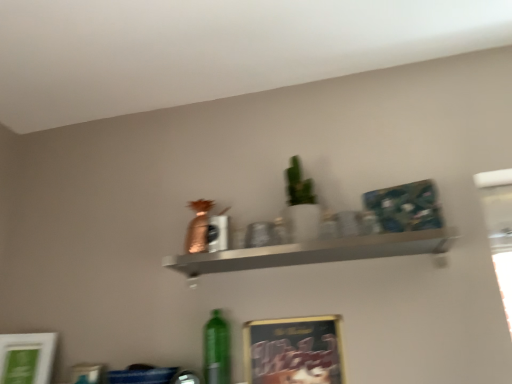
This screenshot has height=384, width=512. Describe the element at coordinates (316, 252) in the screenshot. I see `metallic silver shelf at center` at that location.

In order to click on metallic silver shelf at center in this screenshot , I will do `click(316, 252)`.

Where is `green matte bottle at lower center`? green matte bottle at lower center is located at coordinates (216, 350).

Considering the positions of point (338, 358) and point (0, 360), is point (338, 358) closer or farther from the camera than point (0, 360)?

Point (338, 358) is closer to the camera than point (0, 360).

Considering the relative sizes of metallic gold picture frame at lower center, marked as the 1th picture frame in a right-to-left arrangement, and white matte picture frame at lower left, the first picture frame from the left, in the image provided, is metallic gold picture frame at lower center, marked as the 1th picture frame in a right-to-left arrangement, shorter than white matte picture frame at lower left, the first picture frame from the left,?

No.

Is metallic gold picture frame at lower center, marked as the 1th picture frame in a right-to-left arrangement, in front of or behind white matte picture frame at lower left, the 2th picture frame when ordered from right to left, in the image?

metallic gold picture frame at lower center, marked as the 1th picture frame in a right-to-left arrangement, is in front of white matte picture frame at lower left, the 2th picture frame when ordered from right to left.

Looking at their sizes, would you say metallic gold picture frame at lower center, which is the 2th picture frame in left-to-right order, is wider or thinner than white matte picture frame at lower left, the 2th picture frame when ordered from right to left?

Clearly, metallic gold picture frame at lower center, which is the 2th picture frame in left-to-right order, has less width compared to white matte picture frame at lower left, the 2th picture frame when ordered from right to left.

Is point (42, 350) closer to camera compared to point (230, 372)?

No, (42, 350) is behind (230, 372).

There is a green matte bottle at lower center. Where is `the 1st picture frame below it (from the image's perspective)`? The height and width of the screenshot is (384, 512). the 1st picture frame below it (from the image's perspective) is located at coordinates (26, 357).

Is white matte picture frame at lower left, the 2th picture frame when ordered from right to left, facing towards green matte bottle at lower center?

No, white matte picture frame at lower left, the 2th picture frame when ordered from right to left, is not aimed at green matte bottle at lower center.

Is there a large distance between metallic silver shelf at center and green matte bottle at lower center?

No, there isn't a large distance between metallic silver shelf at center and green matte bottle at lower center.

How far apart are metallic silver shelf at center and green matte bottle at lower center?

metallic silver shelf at center and green matte bottle at lower center are 33.80 centimeters apart.

Which is less distant, (342,251) or (211,379)?

Positioned in front is point (342,251).

Does metallic silver shelf at center come behind green matte bottle at lower center?

No, it is in front of green matte bottle at lower center.

Is metallic gold picture frame at lower center, marked as the 1th picture frame in a right-to-left arrangement, outside of metallic silver shelf at center?

Yes.

Find the location of a particular element. shelf on the right of metallic gold picture frame at lower center, which is the 2th picture frame in left-to-right order is located at coordinates (316, 252).

Considering the sizes of objects white matte picture frame at lower left, the first picture frame from the left, and metallic gold picture frame at lower center, marked as the 1th picture frame in a right-to-left arrangement, in the image provided, who is taller, white matte picture frame at lower left, the first picture frame from the left, or metallic gold picture frame at lower center, marked as the 1th picture frame in a right-to-left arrangement,?

metallic gold picture frame at lower center, marked as the 1th picture frame in a right-to-left arrangement.

Is white matte picture frame at lower left, the 2th picture frame when ordered from right to left, oriented away from metallic gold picture frame at lower center, marked as the 1th picture frame in a right-to-left arrangement?

white matte picture frame at lower left, the 2th picture frame when ordered from right to left, is not turned away from metallic gold picture frame at lower center, marked as the 1th picture frame in a right-to-left arrangement.

How different are the orientations of white matte picture frame at lower left, the first picture frame from the left, and metallic gold picture frame at lower center, which is the 2th picture frame in left-to-right order, in degrees?

There is a 21.1-degree angle between the facing directions of white matte picture frame at lower left, the first picture frame from the left, and metallic gold picture frame at lower center, which is the 2th picture frame in left-to-right order.

Choose the correct answer: Is white matte picture frame at lower left, the first picture frame from the left, inside metallic gold picture frame at lower center, marked as the 1th picture frame in a right-to-left arrangement, or outside it?

white matte picture frame at lower left, the first picture frame from the left, lies outside metallic gold picture frame at lower center, marked as the 1th picture frame in a right-to-left arrangement.

Between green matte bottle at lower center and white matte picture frame at lower left, the first picture frame from the left, which one has less height?

green matte bottle at lower center is shorter.

Is green matte bottle at lower center thinner than white matte picture frame at lower left, the first picture frame from the left?

Yes.

Which object is more forward, green matte bottle at lower center or white matte picture frame at lower left, the 2th picture frame when ordered from right to left?

Positioned in front is white matte picture frame at lower left, the 2th picture frame when ordered from right to left.

Would you say green matte bottle at lower center is inside or outside white matte picture frame at lower left, the first picture frame from the left?

green matte bottle at lower center is not inside white matte picture frame at lower left, the first picture frame from the left, it's outside.

Considering the positions of objects metallic silver shelf at center and white matte picture frame at lower left, the 2th picture frame when ordered from right to left, in the image provided, who is in front, metallic silver shelf at center or white matte picture frame at lower left, the 2th picture frame when ordered from right to left,?

metallic silver shelf at center.

Is metallic silver shelf at center spatially inside white matte picture frame at lower left, the first picture frame from the left, or outside of it?

The correct answer is: outside.

Is point (353, 257) closer to camera compared to point (42, 334)?

Yes, point (353, 257) is closer to viewer.

Can you tell me how much metallic silver shelf at center and white matte picture frame at lower left, the 2th picture frame when ordered from right to left, differ in facing direction?

The angle between the facing direction of metallic silver shelf at center and the facing direction of white matte picture frame at lower left, the 2th picture frame when ordered from right to left, is 20.6 degrees.

You are a GUI agent. You are given a task and a screenshot of the screen. Output one action in this format:
    pyautogui.click(x=<x>, y=<y>)
    Task: Click on the picture frame above the metallic gold picture frame at lower center, marked as the 1th picture frame in a right-to-left arrangement (from the image's perspective)
    The image size is (512, 384).
    Given the screenshot: What is the action you would take?
    pyautogui.click(x=26, y=357)

Locate an element on the screen. picture frame on the left of green matte bottle at lower center is located at coordinates coord(26,357).

From the image, which object appears to be farther from metallic gold picture frame at lower center, marked as the 1th picture frame in a right-to-left arrangement, metallic silver shelf at center or green matte bottle at lower center?

metallic silver shelf at center lies further to metallic gold picture frame at lower center, marked as the 1th picture frame in a right-to-left arrangement, than the other object.

Based on their spatial positions, is green matte bottle at lower center or metallic gold picture frame at lower center, which is the 2th picture frame in left-to-right order, further from white matte picture frame at lower left, the 2th picture frame when ordered from right to left?

metallic gold picture frame at lower center, which is the 2th picture frame in left-to-right order.

When comparing their distances from green matte bottle at lower center, does metallic silver shelf at center or metallic gold picture frame at lower center, marked as the 1th picture frame in a right-to-left arrangement, seem closer?

Among the two, metallic gold picture frame at lower center, marked as the 1th picture frame in a right-to-left arrangement, is located nearer to green matte bottle at lower center.

From the image, which object appears to be farther from metallic silver shelf at center, green matte bottle at lower center or metallic gold picture frame at lower center, which is the 2th picture frame in left-to-right order?

green matte bottle at lower center is further to metallic silver shelf at center.

Looking at the image, which one is located further to white matte picture frame at lower left, the 2th picture frame when ordered from right to left, green matte bottle at lower center or metallic silver shelf at center?

Based on the image, metallic silver shelf at center appears to be further to white matte picture frame at lower left, the 2th picture frame when ordered from right to left.

Based on the photo, estimate the real-world distances between objects in this image. Which object is further from green matte bottle at lower center, metallic silver shelf at center or white matte picture frame at lower left, the 2th picture frame when ordered from right to left?

Based on the image, white matte picture frame at lower left, the 2th picture frame when ordered from right to left, appears to be further to green matte bottle at lower center.

Considering their positions, is metallic gold picture frame at lower center, which is the 2th picture frame in left-to-right order, positioned closer to green matte bottle at lower center than metallic silver shelf at center?

The object closer to green matte bottle at lower center is metallic gold picture frame at lower center, which is the 2th picture frame in left-to-right order.

Which object lies nearer to the anchor point metallic gold picture frame at lower center, which is the 2th picture frame in left-to-right order, metallic silver shelf at center or white matte picture frame at lower left, the 2th picture frame when ordered from right to left?

Based on the image, metallic silver shelf at center appears to be nearer to metallic gold picture frame at lower center, which is the 2th picture frame in left-to-right order.

Where is `bottle located between white matte picture frame at lower left, the 2th picture frame when ordered from right to left, and metallic silver shelf at center in the left-right direction`? bottle located between white matte picture frame at lower left, the 2th picture frame when ordered from right to left, and metallic silver shelf at center in the left-right direction is located at coordinates point(216,350).

The height and width of the screenshot is (384, 512). I want to click on picture frame between white matte picture frame at lower left, the first picture frame from the left, and metallic silver shelf at center from left to right, so click(x=293, y=350).

You are a GUI agent. You are given a task and a screenshot of the screen. Output one action in this format:
    pyautogui.click(x=<x>, y=<y>)
    Task: Click on the bottle between white matte picture frame at lower left, the first picture frame from the left, and metallic gold picture frame at lower center, marked as the 1th picture frame in a right-to-left arrangement, from left to right
    The width and height of the screenshot is (512, 384).
    Given the screenshot: What is the action you would take?
    pyautogui.click(x=216, y=350)

Locate an element on the screen. bottle between metallic silver shelf at center and metallic gold picture frame at lower center, marked as the 1th picture frame in a right-to-left arrangement, from top to bottom is located at coordinates (216, 350).